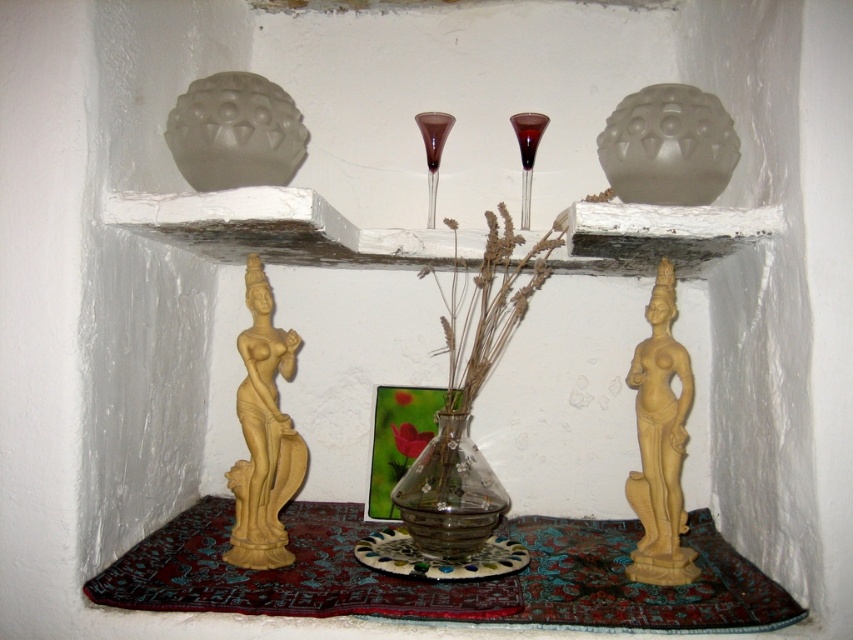
Question: Which point appears closest to the camera in this image?

Choices:
 (A) (654, 310)
 (B) (442, 508)

Answer: (A)

Question: Which of the following is the farthest from the observer?

Choices:
 (A) (437, 476)
 (B) (657, 284)

Answer: (A)

Question: Which of the following is the farthest from the observer?

Choices:
 (A) (659, 577)
 (B) (440, 493)
 (C) (268, 554)

Answer: (B)

Question: Is matte yellow statue at lower right to the left of transparent glass vase at center from the viewer's perspective?

Choices:
 (A) yes
 (B) no

Answer: (B)

Question: Is matte yellow statue at lower right below transparent glass vase at center?

Choices:
 (A) yes
 (B) no

Answer: (B)

Question: Observing the image, what is the correct spatial positioning of matte yellow statue at lower left in reference to transparent glass vase at center?

Choices:
 (A) right
 (B) left

Answer: (B)